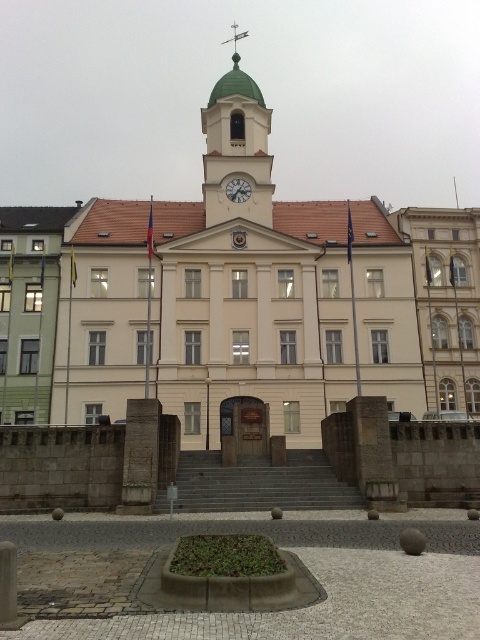
Does white smooth building at center have a greater height compared to green dome clock tower at center?

Yes.

Does white smooth building at center appear on the right side of green dome clock tower at center?

Yes, white smooth building at center is to the right of green dome clock tower at center.

What do you see at coordinates (235, 296) in the screenshot?
I see `white smooth building at center` at bounding box center [235, 296].

Where is `white smooth building at center`? The width and height of the screenshot is (480, 640). white smooth building at center is located at coordinates [x=235, y=296].

Is green dome clock tower at center taller than metallic clock at center?

Yes, green dome clock tower at center is taller than metallic clock at center.

The width and height of the screenshot is (480, 640). What are the coordinates of `green dome clock tower at center` in the screenshot? It's located at (237, 147).

Can you confirm if white smooth building at center is positioned to the right of gray concrete stairs at center?

Incorrect, white smooth building at center is not on the right side of gray concrete stairs at center.

Between white smooth building at center and gray concrete stairs at center, which one has less height?

Standing shorter between the two is gray concrete stairs at center.

Does point (62, 396) come in front of point (276, 506)?

No, it is behind (276, 506).

This screenshot has height=640, width=480. Identify the location of white smooth building at center. pyautogui.click(x=235, y=296).